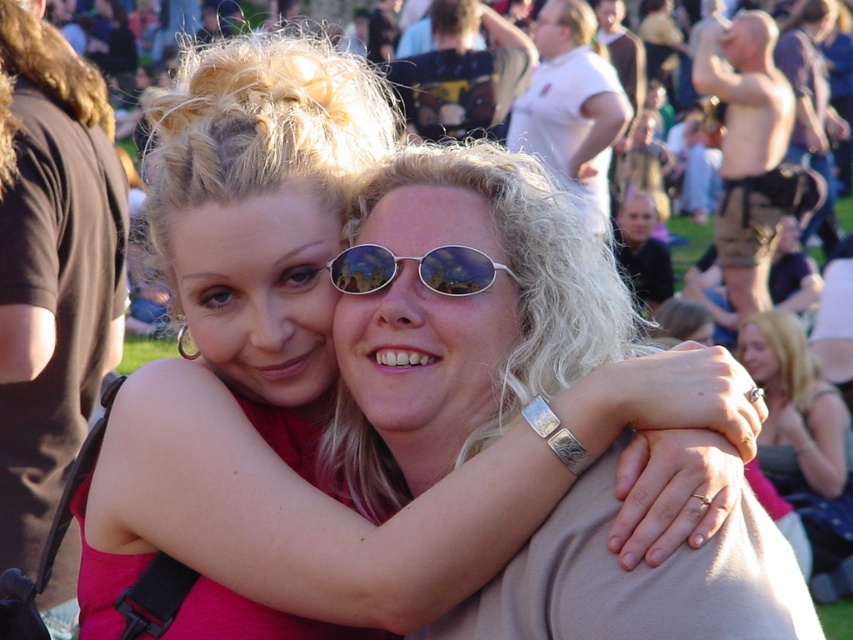
You are a photographer at the event and want to capture a closeup of the sunglasses at center without including the blonde hair at center. Given their sizes, is this possible?

The sunglasses at center are larger than the blonde hair at center, so it is possible to capture a closeup of the sunglasses at center without including the blonde hair at center by focusing on the larger sunglasses.

Based on the scene description, which object is wider between the blonde hair at center and the sunglasses at center?

The sunglasses at center are wider than the blonde hair at center.

Based on the scene description, where is the blonde hair at center located in the image?

The blonde hair at center is located at the 2D coordinates point (804,444).